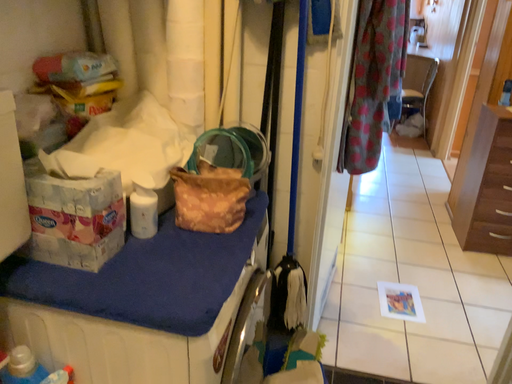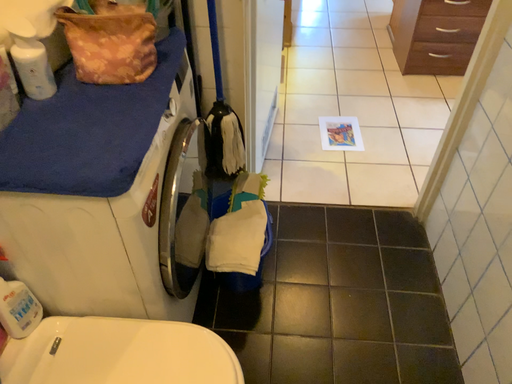
Question: How did the camera likely rotate when shooting the video?

Choices:
 (A) rotated downward
 (B) rotated upward

Answer: (A)